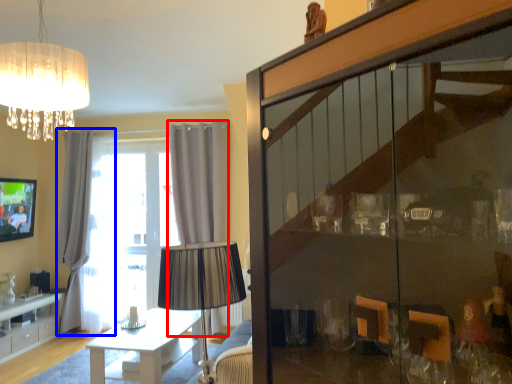
Question: Among these objects, which one is nearest to the camera, curtain (highlighted by a red box) or curtain (highlighted by a blue box)?

Choices:
 (A) curtain
 (B) curtain

Answer: (A)